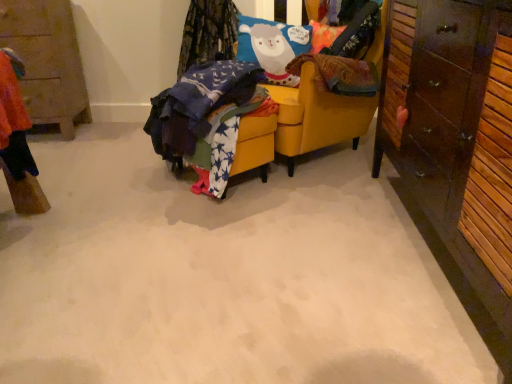
Question: Choose the correct answer: Is dark brown wood cabinet at right, which is the 2th cabinetry in left-to-right order, inside wooden cabinet at left, the 1th cabinetry when ordered from left to right, or outside it?

Choices:
 (A) outside
 (B) inside

Answer: (A)

Question: Visually, is dark brown wood cabinet at right, acting as the second cabinetry starting from the back, positioned to the left or to the right of wooden cabinet at left, which appears as the first cabinetry when viewed from the back?

Choices:
 (A) left
 (B) right

Answer: (B)

Question: Estimate the real-world distances between objects in this image. Which object is farther from the dark brown wood cabinet at right, the first cabinetry positioned from the front?

Choices:
 (A) star-patterned fabric at center
 (B) yellow fabric chair at center
 (C) wooden cabinet at left, which ranks as the 2th cabinetry in front-to-back order

Answer: (C)

Question: Which object is positioned closest to the yellow fabric chair at center?

Choices:
 (A) star-patterned fabric at center
 (B) wooden cabinet at left, which appears as the second cabinetry when viewed from the right
 (C) dark brown wood cabinet at right, acting as the second cabinetry starting from the back

Answer: (A)